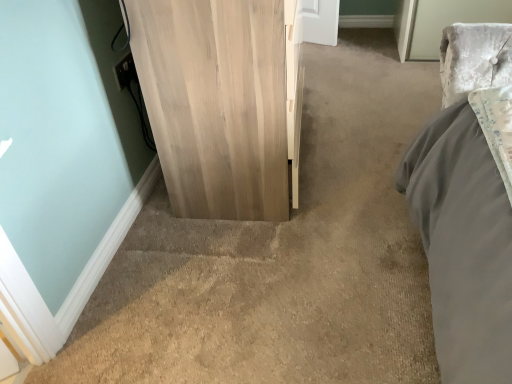
I want to click on light wood door at center, so click(x=216, y=103).

This screenshot has width=512, height=384. Describe the element at coordinates (216, 103) in the screenshot. I see `light wood door at center` at that location.

Identify the location of light wood door at center. (216, 103).